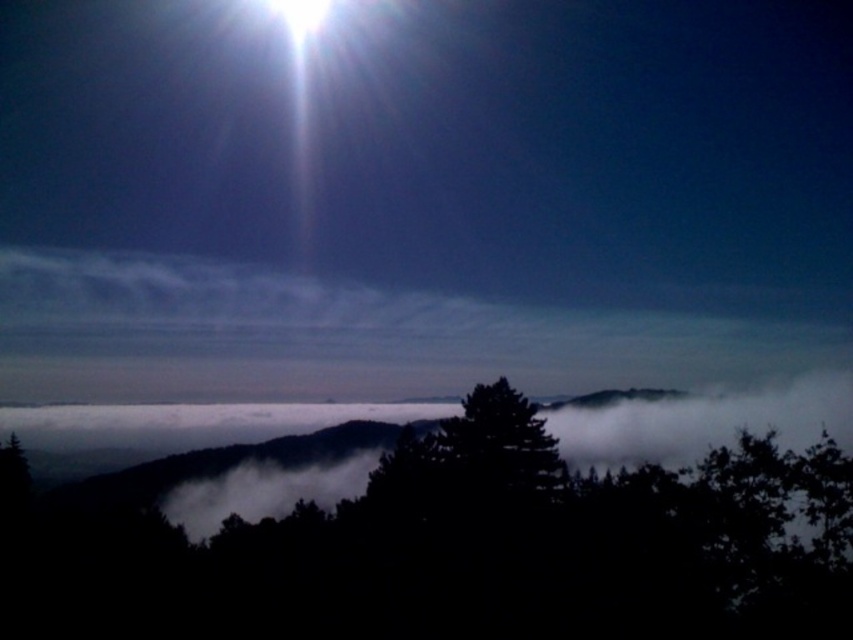
Does dark green leafy tree at center have a greater width compared to bright white light at upper center?

Indeed, dark green leafy tree at center has a greater width compared to bright white light at upper center.

Measure the distance between dark green leafy tree at center and camera.

The distance of dark green leafy tree at center from camera is 25.05 meters.

This screenshot has width=853, height=640. Identify the location of dark green leafy tree at center. (439, 538).

Where is `dark green leafy tree at center`? dark green leafy tree at center is located at coordinates (439, 538).